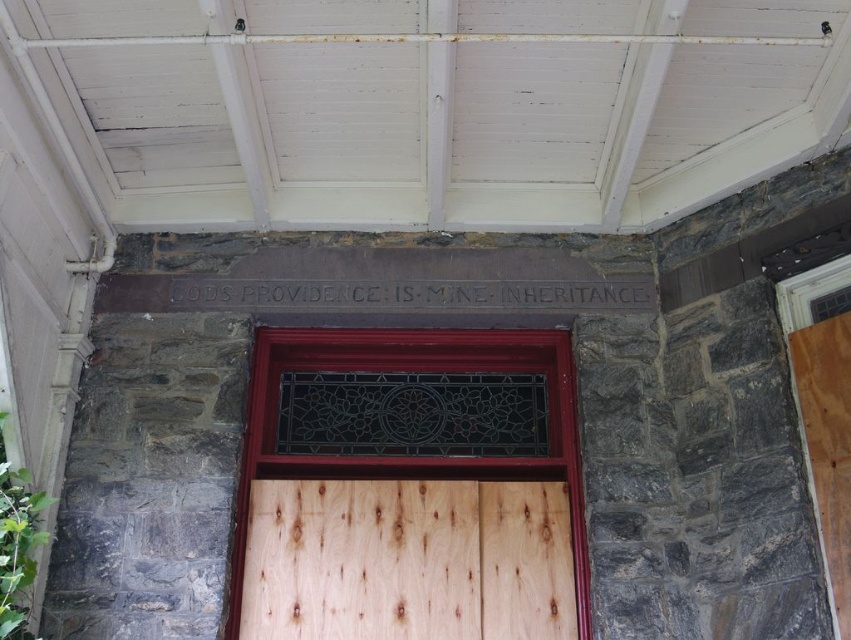
Question: Which point appears farthest from the camera in this image?

Choices:
 (A) (410, 515)
 (B) (278, 556)

Answer: (A)

Question: Observing the image, what is the correct spatial positioning of wooden door at center in reference to natural wood door at center?

Choices:
 (A) right
 (B) left

Answer: (A)

Question: Which point is farther from the camera taking this photo?

Choices:
 (A) (581, 588)
 (B) (477, 518)

Answer: (B)

Question: Does wooden door at center have a larger size compared to natural wood door at center?

Choices:
 (A) yes
 (B) no

Answer: (A)

Question: Which point is closer to the camera?

Choices:
 (A) (410, 550)
 (B) (494, 349)

Answer: (A)

Question: In this image, where is wooden door at center located relative to natural wood door at center?

Choices:
 (A) below
 (B) above

Answer: (B)